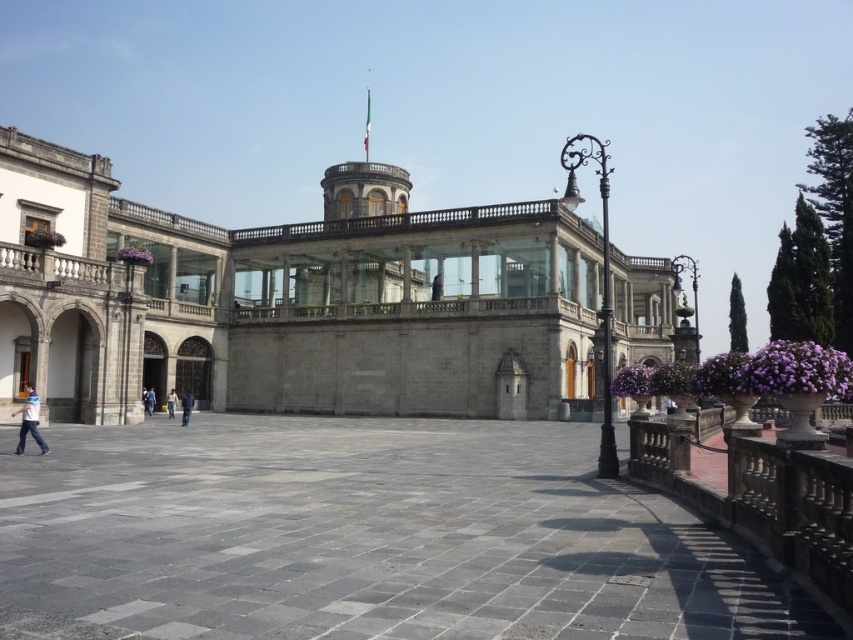
Can you confirm if gray stone courtyard at center is thinner than gray stone building at center?

Yes, gray stone courtyard at center is thinner than gray stone building at center.

This screenshot has width=853, height=640. Describe the element at coordinates (364, 538) in the screenshot. I see `gray stone courtyard at center` at that location.

Where is `gray stone courtyard at center`? Image resolution: width=853 pixels, height=640 pixels. gray stone courtyard at center is located at coordinates (364, 538).

Find the location of a particular element. The height and width of the screenshot is (640, 853). gray stone courtyard at center is located at coordinates (364, 538).

Can you confirm if gray stone courtyard at center is positioned to the right of light blue jeans at lower left?

Indeed, gray stone courtyard at center is positioned on the right side of light blue jeans at lower left.

Is gray stone courtyard at center closer to camera compared to light blue jeans at lower left?

Yes, it is in front of light blue jeans at lower left.

Which is in front, point (193, 481) or point (45, 448)?

Point (193, 481)

You are a GUI agent. You are given a task and a screenshot of the screen. Output one action in this format:
    pyautogui.click(x=<x>, y=<y>)
    Task: Click on the gray stone courtyard at center
    The image size is (853, 640).
    Given the screenshot: What is the action you would take?
    pyautogui.click(x=364, y=538)

Between gray stone courtyard at center and blue jeans at center, which one has more height?

gray stone courtyard at center is taller.

Is point (558, 481) farther from viewer compared to point (148, 404)?

No, (558, 481) is closer to viewer.

Which is in front, point (583, 468) or point (149, 388)?

Point (583, 468) is more forward.

Locate an element on the screen. gray stone courtyard at center is located at coordinates (364, 538).